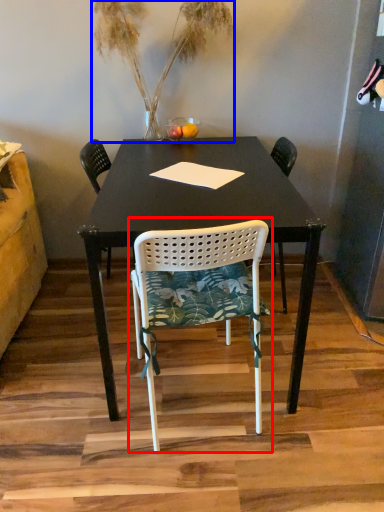
Question: Which object appears farthest to the camera in this image, chair (highlighted by a red box) or houseplant (highlighted by a blue box)?

Choices:
 (A) chair
 (B) houseplant

Answer: (B)